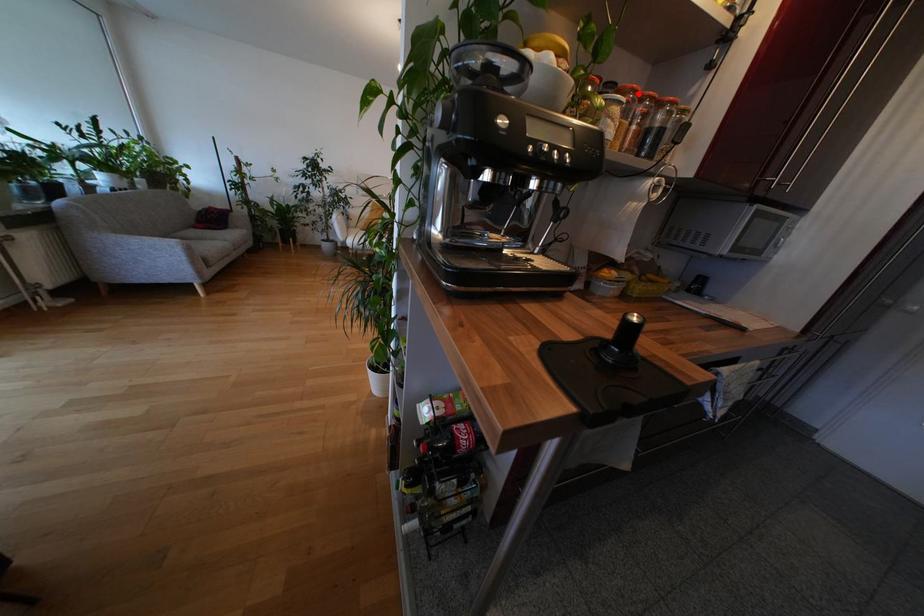
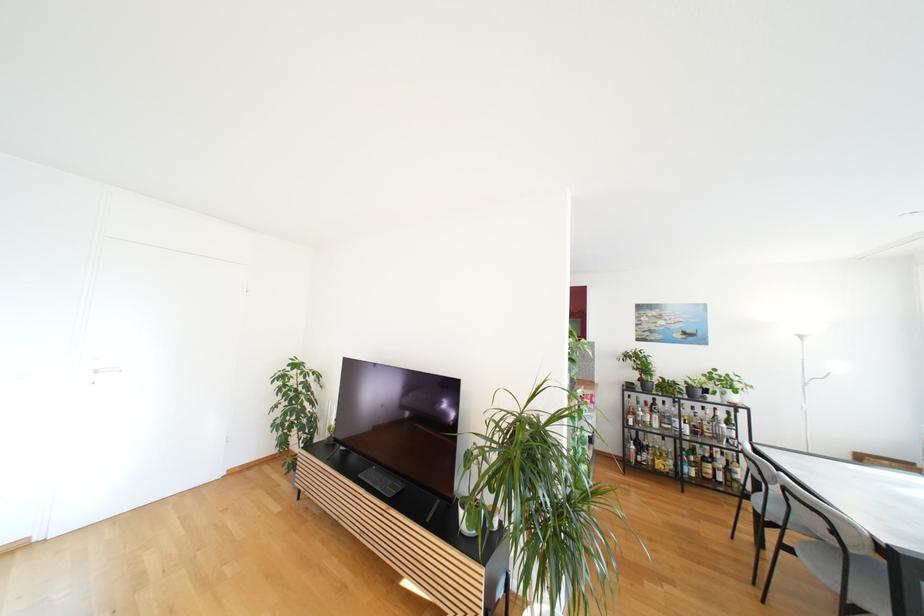
Question: I am providing you with two images of the same scene from different viewpoints. A red point is marked on the first image. Is the red point's position out of view in image 2?

Choices:
 (A) Yes
 (B) No

Answer: (A)